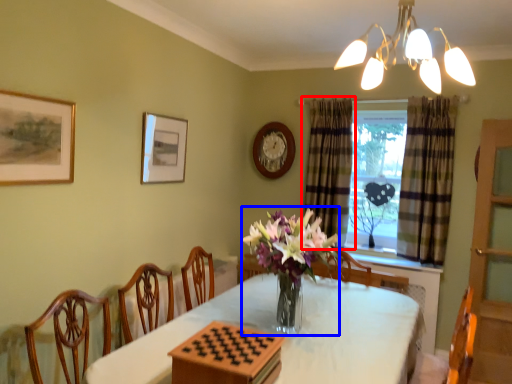
Question: Which of the following is the farthest to the observer, curtain (highlighted by a red box) or floral arrangement (highlighted by a blue box)?

Choices:
 (A) curtain
 (B) floral arrangement

Answer: (A)